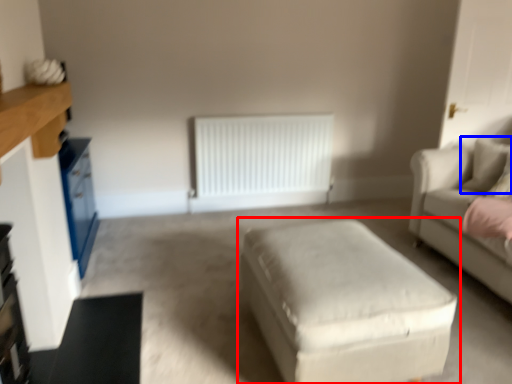
Question: Which object appears closest to the camera in this image, table (highlighted by a red box) or pillow (highlighted by a blue box)?

Choices:
 (A) table
 (B) pillow

Answer: (A)